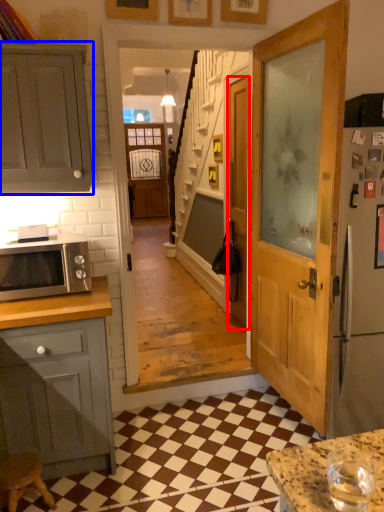
Question: Which of the following is the closest to the observer, door (highlighted by a red box) or cabinetry (highlighted by a blue box)?

Choices:
 (A) door
 (B) cabinetry

Answer: (B)